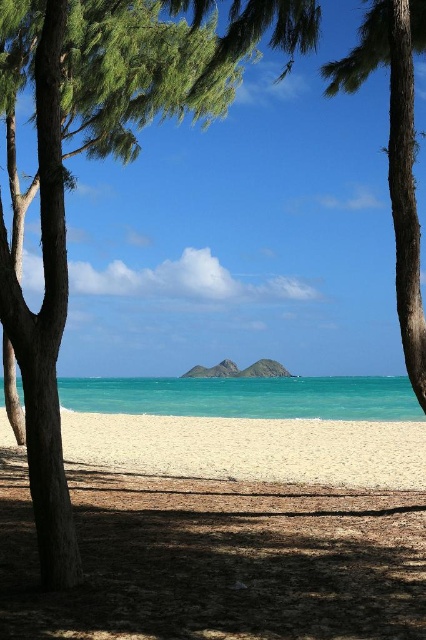
Question: Can you confirm if white sand at center is thinner than brown textured tree at center?

Choices:
 (A) yes
 (B) no

Answer: (B)

Question: Among these points, which one is farthest from the camera?

Choices:
 (A) (135, 412)
 (B) (336, 81)
 (C) (302, 24)
 (D) (253, 525)

Answer: (A)

Question: Which of the following is the farthest from the observer?

Choices:
 (A) white sandy beach at center
 (B) white sand at center
 (C) brown textured tree at center
 (D) turquoise water at center

Answer: (D)

Question: Can you confirm if green leafy tree at center is positioned below white sandy beach at center?

Choices:
 (A) no
 (B) yes

Answer: (A)

Question: Is green leafy tree at center smaller than brown textured tree at center?

Choices:
 (A) yes
 (B) no

Answer: (A)

Question: Which point is closer to the camera?

Choices:
 (A) coord(333,464)
 (B) coord(402,148)

Answer: (B)